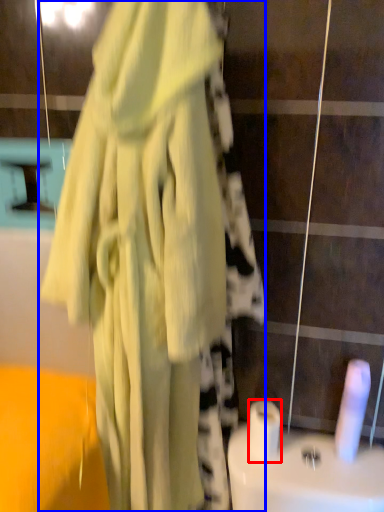
Question: Which of the following is the closest to the observer, toilet paper (highlighted by a red box) or fancy dress (highlighted by a blue box)?

Choices:
 (A) toilet paper
 (B) fancy dress

Answer: (B)